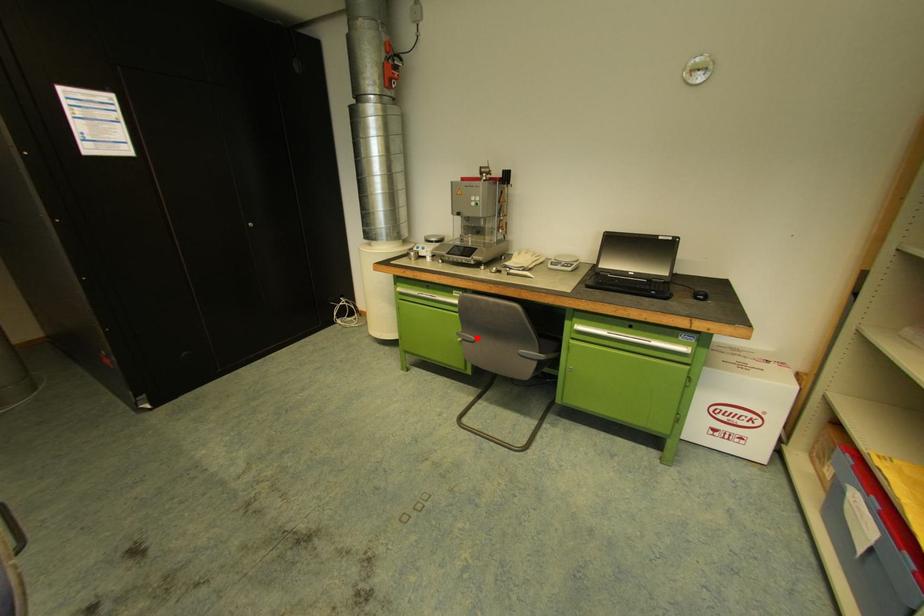
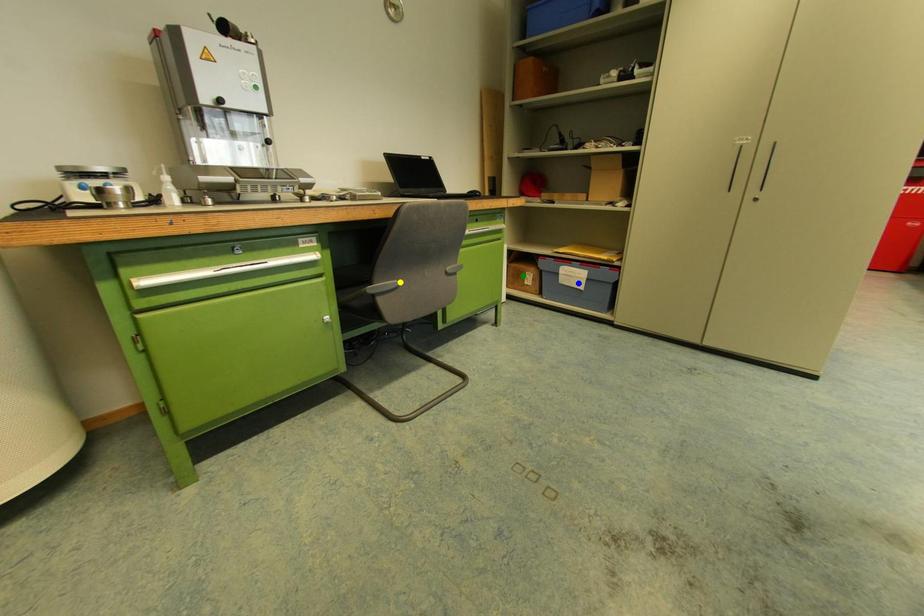
Question: I am providing you with two images of the same scene from different viewpoints. A red point is marked on the first image. You are given multiple points on the second image. Which point in image 2 is actually the same real-world point as the red point in image 1?

Choices:
 (A) blue point
 (B) yellow point
 (C) green point

Answer: (B)